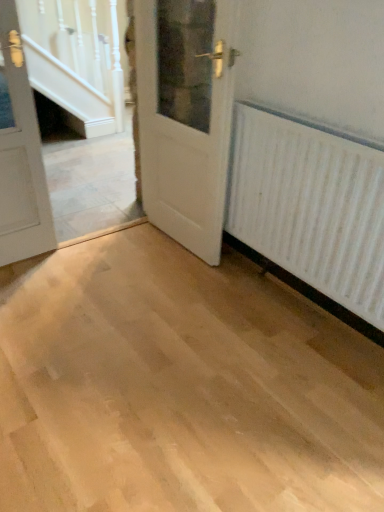
Question: Is white wood door at center, the 1th door positioned from the right, wider than white textured radiator at right?

Choices:
 (A) yes
 (B) no

Answer: (A)

Question: From the image's perspective, does white wood door at center, the 1th door positioned from the right, appear lower than white textured radiator at right?

Choices:
 (A) yes
 (B) no

Answer: (B)

Question: Would you say white wood door at center, the 1th door positioned from the right, contains white textured radiator at right?

Choices:
 (A) yes
 (B) no

Answer: (B)

Question: Is the depth of white wood door at center, placed as the 2th door when sorted from left to right, less than that of white textured radiator at right?

Choices:
 (A) no
 (B) yes

Answer: (A)

Question: Is white wood door at center, placed as the 2th door when sorted from left to right, thinner than white textured radiator at right?

Choices:
 (A) no
 (B) yes

Answer: (A)

Question: Considering the relative positions of white wood door at center, the 1th door positioned from the right, and white textured radiator at right in the image provided, is white wood door at center, the 1th door positioned from the right, behind white textured radiator at right?

Choices:
 (A) no
 (B) yes

Answer: (B)

Question: Is white wood door at left, the 1th door when ordered from left to right, outside white wood door at center, the 1th door positioned from the right?

Choices:
 (A) no
 (B) yes

Answer: (B)

Question: Can white wood door at center, placed as the 2th door when sorted from left to right, be found inside white wood door at left, the 2th door viewed from the right?

Choices:
 (A) no
 (B) yes

Answer: (A)

Question: From the image's perspective, would you say white wood door at left, the 1th door when ordered from left to right, is positioned over white wood door at center, placed as the 2th door when sorted from left to right?

Choices:
 (A) no
 (B) yes

Answer: (A)

Question: Is there a large distance between white wood door at left, the 1th door when ordered from left to right, and white wood door at center, the 1th door positioned from the right?

Choices:
 (A) yes
 (B) no

Answer: (B)

Question: Considering the relative positions of white wood door at left, the 2th door viewed from the right, and white wood door at center, placed as the 2th door when sorted from left to right, in the image provided, is white wood door at left, the 2th door viewed from the right, to the right of white wood door at center, placed as the 2th door when sorted from left to right, from the viewer's perspective?

Choices:
 (A) yes
 (B) no

Answer: (B)

Question: Is white wood door at left, the 2th door viewed from the right, taller than white wood door at center, the 1th door positioned from the right?

Choices:
 (A) yes
 (B) no

Answer: (B)

Question: Is white wood door at left, the 1th door when ordered from left to right, aimed at white textured radiator at right?

Choices:
 (A) no
 (B) yes

Answer: (A)